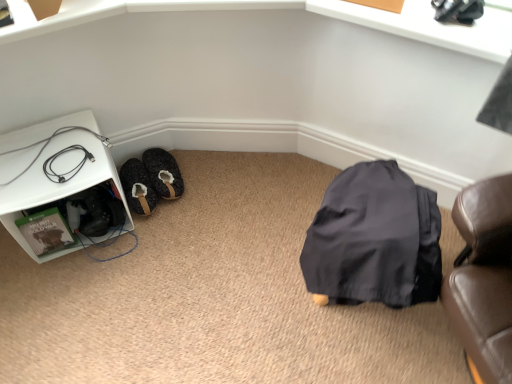
Question: From the image's perspective, is white plastic shelf at left under black rubber cable at lower left?

Choices:
 (A) no
 (B) yes

Answer: (B)

Question: From the image's perspective, is white plastic shelf at left located above black rubber cable at lower left?

Choices:
 (A) yes
 (B) no

Answer: (B)

Question: Is white plastic shelf at left facing away from black rubber cable at lower left?

Choices:
 (A) yes
 (B) no

Answer: (B)

Question: Is white plastic shelf at left thinner than black rubber cable at lower left?

Choices:
 (A) no
 (B) yes

Answer: (A)

Question: Can you confirm if white plastic shelf at left is taller than black rubber cable at lower left?

Choices:
 (A) yes
 (B) no

Answer: (A)

Question: Is the position of white plastic shelf at left more distant than that of black rubber cable at lower left?

Choices:
 (A) no
 (B) yes

Answer: (A)

Question: Considering the relative sizes of fuzzy fabric slipper at lower left and black rubber cable at lower left in the image provided, is fuzzy fabric slipper at lower left bigger than black rubber cable at lower left?

Choices:
 (A) yes
 (B) no

Answer: (A)

Question: Are fuzzy fabric slipper at lower left and black rubber cable at lower left far apart?

Choices:
 (A) no
 (B) yes

Answer: (A)

Question: Is black rubber cable at lower left a part of fuzzy fabric slipper at lower left?

Choices:
 (A) yes
 (B) no

Answer: (B)

Question: Is fuzzy fabric slipper at lower left facing away from black rubber cable at lower left?

Choices:
 (A) no
 (B) yes

Answer: (A)

Question: Considering the relative positions of fuzzy fabric slipper at lower left and black rubber cable at lower left in the image provided, is fuzzy fabric slipper at lower left to the right of black rubber cable at lower left from the viewer's perspective?

Choices:
 (A) yes
 (B) no

Answer: (A)

Question: Can you confirm if fuzzy fabric slipper at lower left is taller than black rubber cable at lower left?

Choices:
 (A) no
 (B) yes

Answer: (B)

Question: From a real-world perspective, is fuzzy fabric slipper at lower left beneath fuzzy fabric slippers at lower left?

Choices:
 (A) yes
 (B) no

Answer: (B)